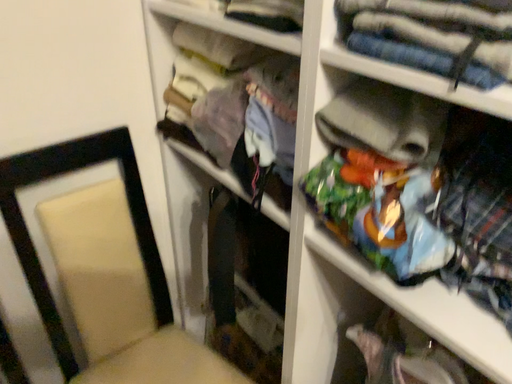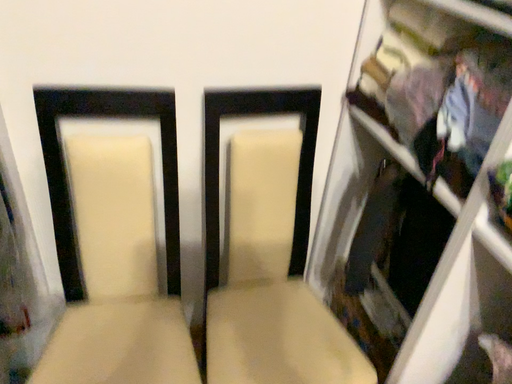
Question: Which way did the camera rotate in the video?

Choices:
 (A) rotated right
 (B) rotated left

Answer: (B)